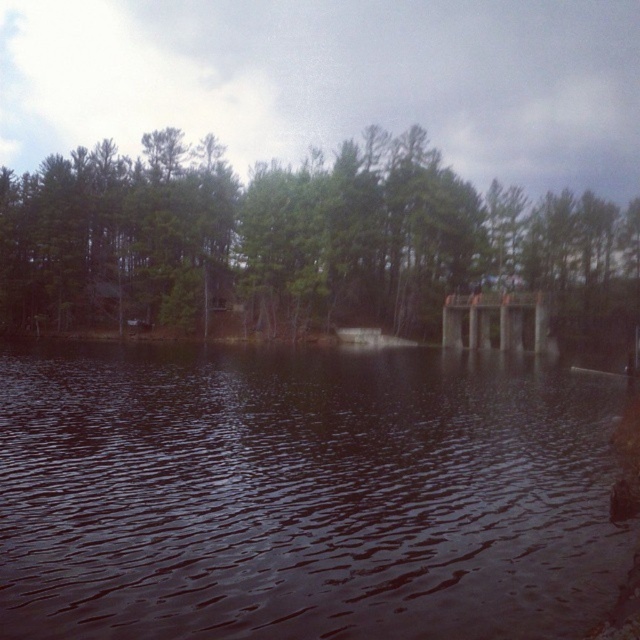
Question: Is dark reflective water at center positioned before green leafy trees at center?

Choices:
 (A) no
 (B) yes

Answer: (B)

Question: Which of these objects is positioned farthest from the dark reflective water at center?

Choices:
 (A) wooden dock at center
 (B) green leafy trees at center

Answer: (B)

Question: Which object is the closest to the dark reflective water at center?

Choices:
 (A) green leafy trees at center
 (B) wooden dock at center

Answer: (B)

Question: Which point is farther to the camera?

Choices:
 (A) dark reflective water at center
 (B) green leafy trees at center

Answer: (B)

Question: In this image, where is dark reflective water at center located relative to wooden dock at center?

Choices:
 (A) below
 (B) above

Answer: (A)

Question: Is dark reflective water at center positioned at the back of wooden dock at center?

Choices:
 (A) no
 (B) yes

Answer: (A)